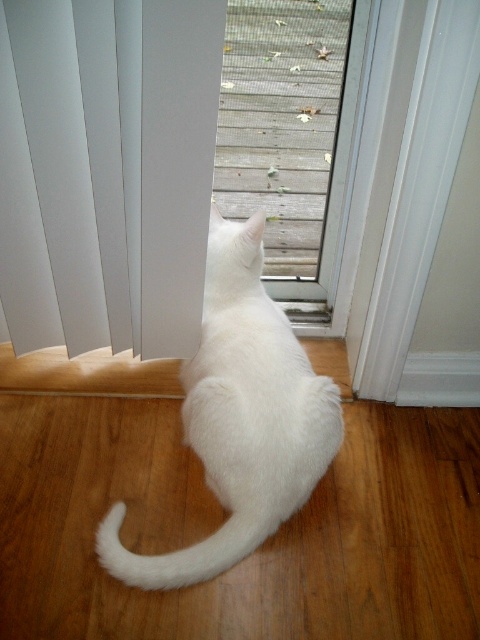
Image resolution: width=480 pixels, height=640 pixels. Describe the element at coordinates (107, 170) in the screenshot. I see `white matte blinds at center` at that location.

Between white matte blinds at center and white fluffy tail at lower center, which one has more height?

white matte blinds at center is taller.

I want to click on white matte blinds at center, so click(x=107, y=170).

Identify the location of white matte blinds at center. This screenshot has width=480, height=640. (107, 170).

Does white fluffy cat at center appear under white fluffy tail at lower center?

Actually, white fluffy cat at center is above white fluffy tail at lower center.

Looking at this image, measure the distance from white fluffy cat at center to white fluffy tail at lower center.

A distance of 6.03 inches exists between white fluffy cat at center and white fluffy tail at lower center.

Does point (267, 301) come closer to viewer compared to point (226, 552)?

No, it is not.

The height and width of the screenshot is (640, 480). In order to click on white fluffy cat at center in this screenshot , I will do click(240, 417).

Which is above, white matte blinds at center or white fluffy cat at center?

white matte blinds at center

Looking at this image, is white matte blinds at center positioned before white fluffy cat at center?

Yes.

Is point (40, 192) behind point (219, 269)?

No, (40, 192) is in front of (219, 269).

You are a GUI agent. You are given a task and a screenshot of the screen. Output one action in this format:
    pyautogui.click(x=<x>, y=<y>)
    Task: Click on the white matte blinds at center
    
    Given the screenshot: What is the action you would take?
    pyautogui.click(x=107, y=170)